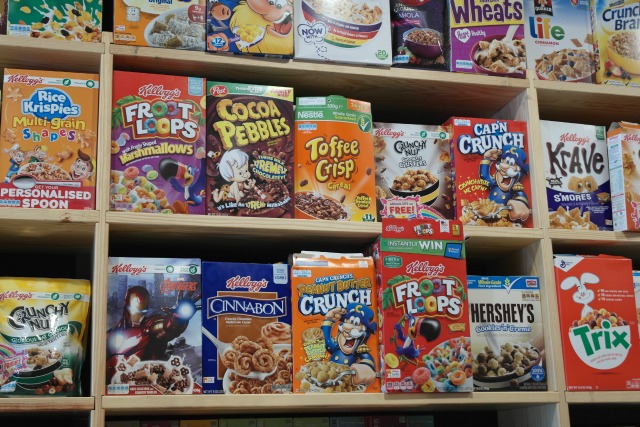
You are a GUI agent. You are given a task and a screenshot of the screen. Output one action in this format:
    pyautogui.click(x=<x>, y=<y>)
    Task: Click on the boxes of cereal on the bottom shelf
    Image resolution: width=640 pixels, height=427 pixels.
    Given the screenshot: What is the action you would take?
    coord(419,421), coord(385,422), coord(345,424), coord(310,423), coord(276,423), coord(241,422), coord(198,422)